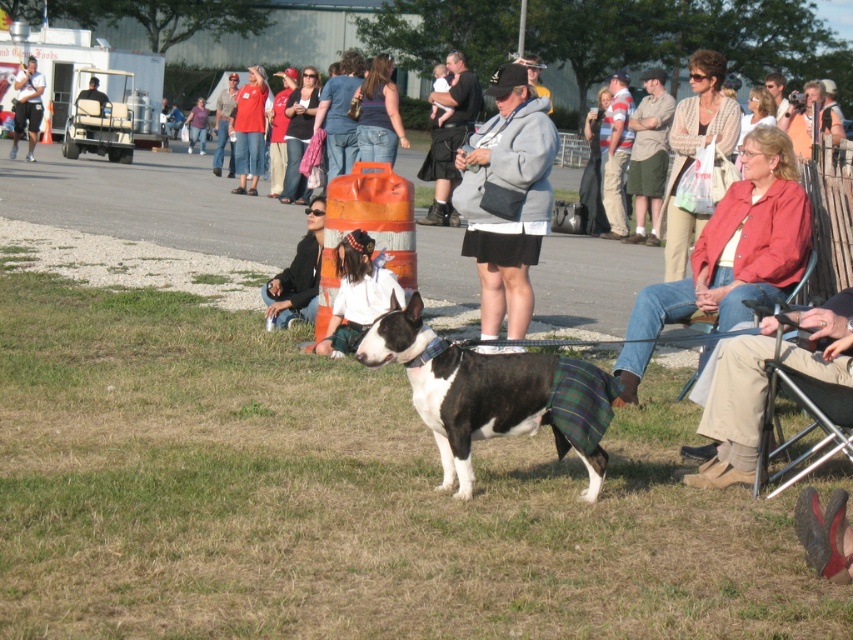
Question: Which of the following is the farthest from the observer?

Choices:
 (A) (498, 360)
 (B) (453, 96)
 (C) (798, 464)

Answer: (B)

Question: Is black and white dog at center above matte black t-shirt at upper left?

Choices:
 (A) no
 (B) yes

Answer: (A)

Question: Estimate the real-world distances between objects in this image. Which object is closer to the khaki shorts at center?

Choices:
 (A) matte red jacket at right
 (B) black leather jacket at center
 (C) white shirt at center
 (D) metallic silver folding chair at lower right

Answer: (B)

Question: Which point is farther to the camera?

Choices:
 (A) (299, 285)
 (B) (202, 148)
 (C) (637, 212)
 (D) (350, 282)

Answer: (B)

Question: Is gray fleece jacket at center bigger than denim jacket at center?

Choices:
 (A) yes
 (B) no

Answer: (A)

Question: Is green grass at center thinner than denim jeans at upper center?

Choices:
 (A) yes
 (B) no

Answer: (B)